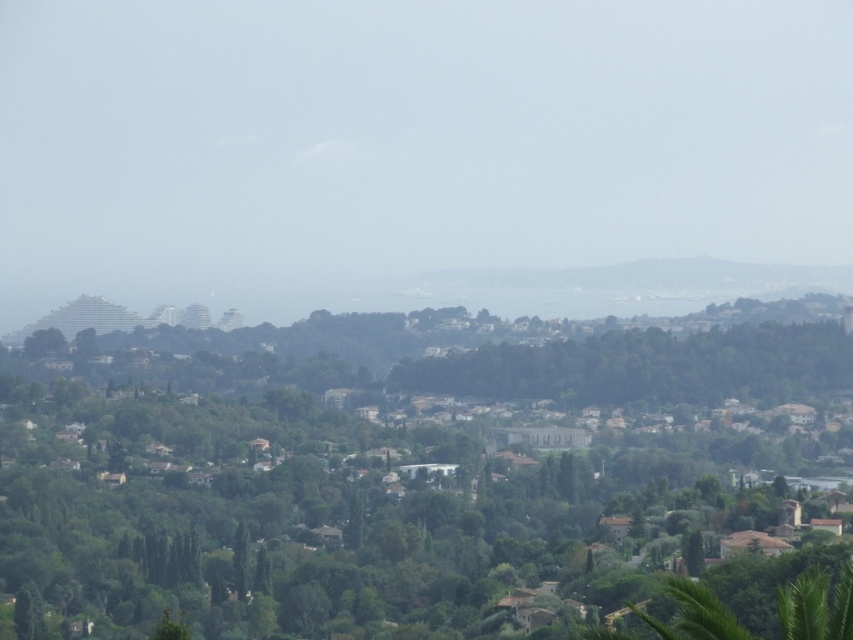
Is point (161, 6) behind point (595, 372)?

Yes.

Who is shorter, transparent glass skyscraper at center or green leafy tree at center?

With less height is transparent glass skyscraper at center.

Which is behind, point (521, 196) or point (816, 417)?

The point (816, 417) is behind.

At what (x,y) coordinates should I click in order to perform the action: click on transparent glass skyscraper at center. Please return your answer as a coordinate pair (x, y). Looking at the image, I should click on (408, 145).